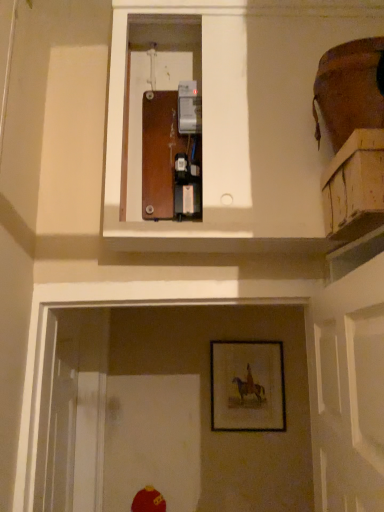
Question: From the image's perspective, is wooden crate at upper right under wooden framed picture at lower center?

Choices:
 (A) yes
 (B) no

Answer: (B)

Question: Can you confirm if wooden crate at upper right is wider than wooden framed picture at lower center?

Choices:
 (A) no
 (B) yes

Answer: (B)

Question: From a real-world perspective, is wooden crate at upper right over wooden framed picture at lower center?

Choices:
 (A) yes
 (B) no

Answer: (A)

Question: Does wooden crate at upper right have a lesser height compared to wooden framed picture at lower center?

Choices:
 (A) yes
 (B) no

Answer: (A)

Question: Does wooden crate at upper right have a lesser width compared to wooden framed picture at lower center?

Choices:
 (A) yes
 (B) no

Answer: (B)

Question: Is wooden crate at upper right oriented towards wooden framed picture at lower center?

Choices:
 (A) yes
 (B) no

Answer: (B)

Question: Considering the relative sizes of wooden framed picture at lower center and wooden crate at upper right in the image provided, is wooden framed picture at lower center taller than wooden crate at upper right?

Choices:
 (A) no
 (B) yes

Answer: (B)

Question: Are wooden framed picture at lower center and wooden crate at upper right making contact?

Choices:
 (A) yes
 (B) no

Answer: (B)

Question: From the image's perspective, does wooden framed picture at lower center appear higher than wooden crate at upper right?

Choices:
 (A) yes
 (B) no

Answer: (B)

Question: From the image's perspective, would you say wooden framed picture at lower center is shown under wooden crate at upper right?

Choices:
 (A) no
 (B) yes

Answer: (B)

Question: Considering the relative sizes of wooden framed picture at lower center and wooden crate at upper right in the image provided, is wooden framed picture at lower center wider than wooden crate at upper right?

Choices:
 (A) yes
 (B) no

Answer: (B)

Question: Is wooden framed picture at lower center completely or partially outside of wooden crate at upper right?

Choices:
 (A) no
 (B) yes

Answer: (B)

Question: Is point (336, 163) closer or farther from the camera than point (271, 394)?

Choices:
 (A) farther
 (B) closer

Answer: (B)